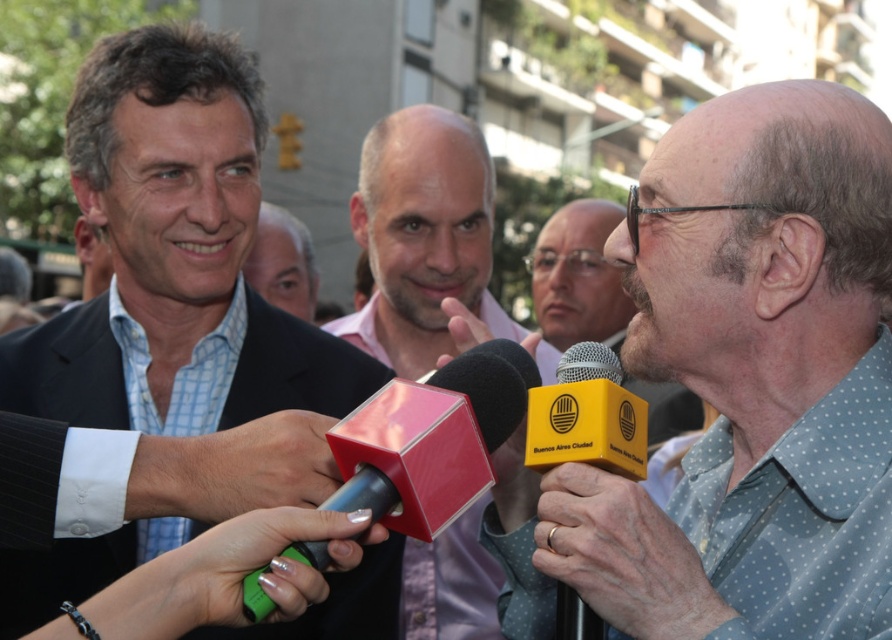
Question: Among these points, which one is nearest to the camera?

Choices:
 (A) (393, 611)
 (B) (847, 156)

Answer: (B)

Question: Among these points, which one is farthest from the camera?

Choices:
 (A) (304, 429)
 (B) (394, 168)

Answer: (B)

Question: Can you confirm if yellow cardboard microphone at center is bigger than matte black suit at center?

Choices:
 (A) no
 (B) yes

Answer: (A)

Question: From the image, what is the correct spatial relationship of rubberized black microphone at center in relation to yellow plastic microphone at center?

Choices:
 (A) left
 (B) right

Answer: (A)

Question: Among these objects, which one is farthest from the camera?

Choices:
 (A) yellow matte microphone at center
 (B) pink matte microphone at center
 (C) green plastic microphone at lower left

Answer: (A)

Question: Is gold metallic ring at upper center further to camera compared to matte pink shirt at center?

Choices:
 (A) no
 (B) yes

Answer: (A)